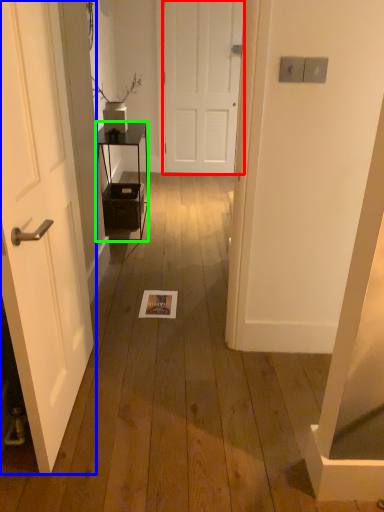
Question: Which object is positioned closest to door (highlighted by a red box)? Select from door (highlighted by a blue box) and furniture (highlighted by a green box).

Choices:
 (A) door
 (B) furniture

Answer: (B)